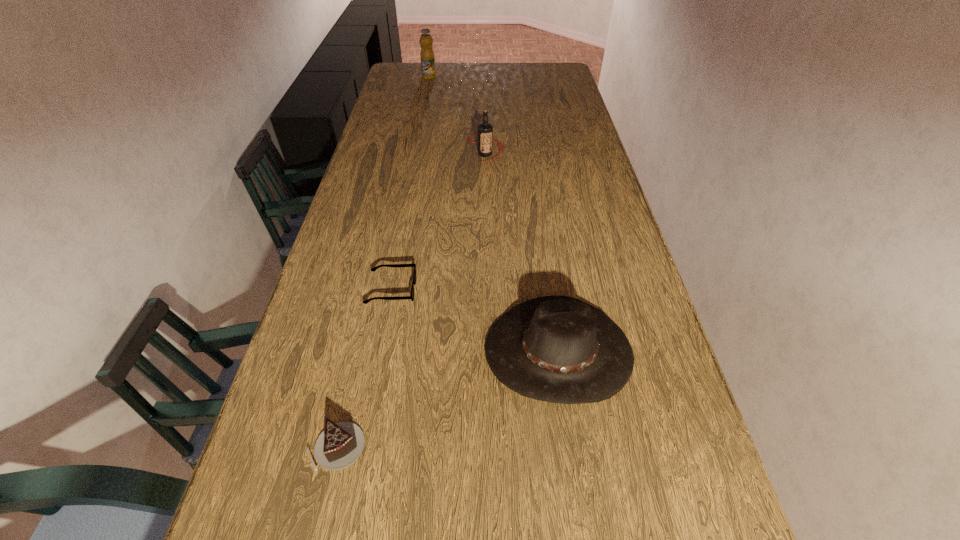
Identify the location of free space located on the front-facing side of the third tallest object. (573, 449).

At what (x,y) coordinates should I click in order to perform the action: click on free space located on the front of the nearest object. Please return your answer as a coordinate pair (x, y). Looking at the image, I should click on (321, 514).

This screenshot has height=540, width=960. I want to click on free space located 0.280m on the arms of the spectacles, so click(524, 291).

Identify the location of object that is at the far edge. (427, 57).

The height and width of the screenshot is (540, 960). Identify the location of fruit juice located at the left edge. (427, 57).

At what (x,y) coordinates should I click in order to perform the action: click on chocolate cake present at the left edge. Please return your answer as a coordinate pair (x, y). The width and height of the screenshot is (960, 540). Looking at the image, I should click on (340, 444).

Identify the location of spectacles that is at the left edge. Image resolution: width=960 pixels, height=540 pixels. (411, 296).

Identify the location of object at the right edge. The image size is (960, 540). (558, 349).

Identify the location of object that is at the far left corner. (427, 57).

At what (x,y) coordinates should I click in order to perform the action: click on blank space at the far edge of the desktop. Please return your answer as a coordinate pair (x, y). The height and width of the screenshot is (540, 960). Looking at the image, I should click on (463, 79).